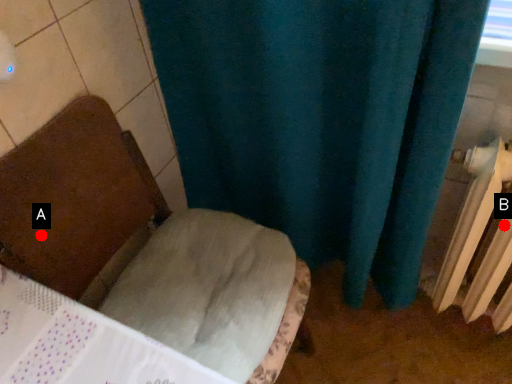
Question: Two points are circled on the image, labeled by A and B beside each circle. Among these points, which one is farthest from the camera?

Choices:
 (A) A is further
 (B) B is further

Answer: (B)